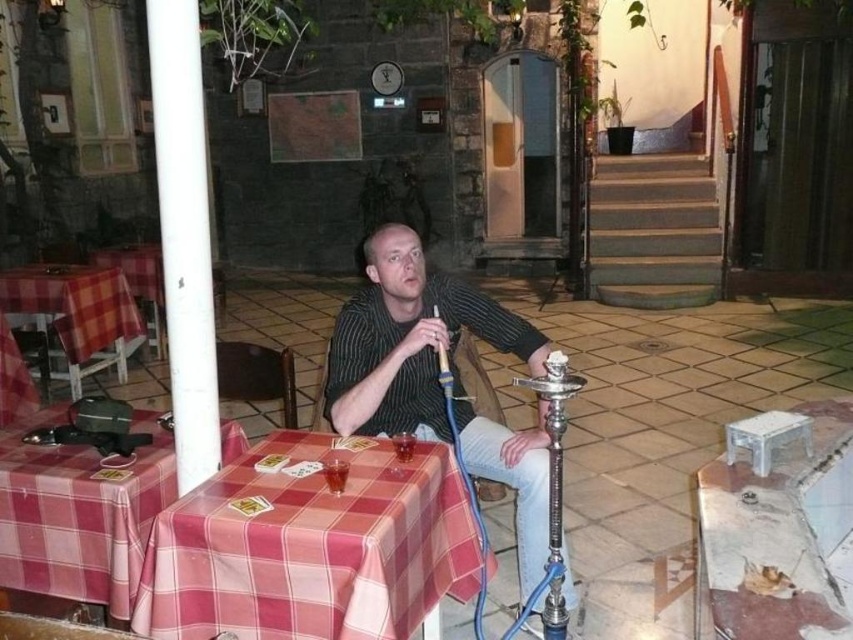
Question: Can you confirm if plaid fabric table at center is smaller than checkered fabric table at left?

Choices:
 (A) yes
 (B) no

Answer: (A)

Question: Among these objects, which one is nearest to the camera?

Choices:
 (A) plaid fabric table at center
 (B) plaid fabric table at lower left

Answer: (A)

Question: Among these objects, which one is nearest to the camera?

Choices:
 (A) checkered fabric table at left
 (B) silver metallic hookah at lower center
 (C) plaid fabric table at lower left

Answer: (B)

Question: Which of the following is the closest to the observer?

Choices:
 (A) (107, 544)
 (B) (550, 378)
 (C) (67, 278)
 (D) (527, 480)

Answer: (B)

Question: Is plaid fabric table at center positioned at the back of plaid fabric table at lower left?

Choices:
 (A) yes
 (B) no

Answer: (B)

Question: Does plaid fabric table at center lie behind striped fabric shirt at center?

Choices:
 (A) no
 (B) yes

Answer: (A)